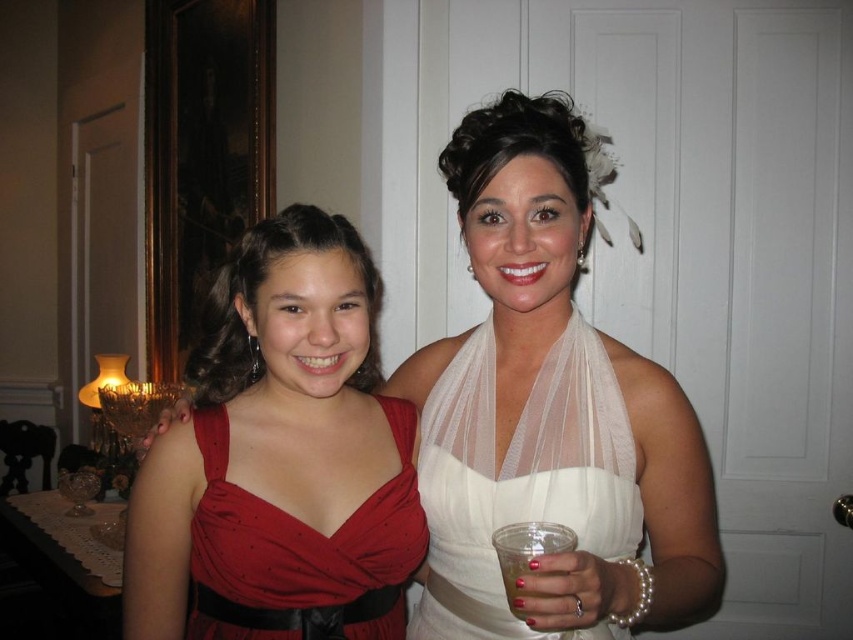
Who is more forward, (x=573, y=305) or (x=520, y=614)?

Point (x=520, y=614) is more forward.

Does point (444, 449) come closer to viewer compared to point (572, 536)?

No, (444, 449) is behind (572, 536).

Locate an element on the screen. The width and height of the screenshot is (853, 640). white sheer veil at center is located at coordinates (520, 480).

Between point (404, 435) and point (575, 547), which one is positioned in front?

Positioned in front is point (575, 547).

Is shiny satin dress at center above clear plastic cup at lower center?

Actually, shiny satin dress at center is below clear plastic cup at lower center.

Which is behind, point (393, 605) or point (575, 534)?

The point (393, 605) is behind.

Where is `shiny satin dress at center`? This screenshot has height=640, width=853. shiny satin dress at center is located at coordinates pyautogui.click(x=302, y=552).

Is white sheer dress at center to the left of matte red dress at left from the viewer's perspective?

No, white sheer dress at center is not to the left of matte red dress at left.

Between point (703, 445) and point (236, 470), which one is positioned in front?

Point (236, 470)

Who is more forward, (457, 340) or (268, 564)?

Positioned in front is point (268, 564).

This screenshot has height=640, width=853. I want to click on white sheer dress at center, so click(549, 412).